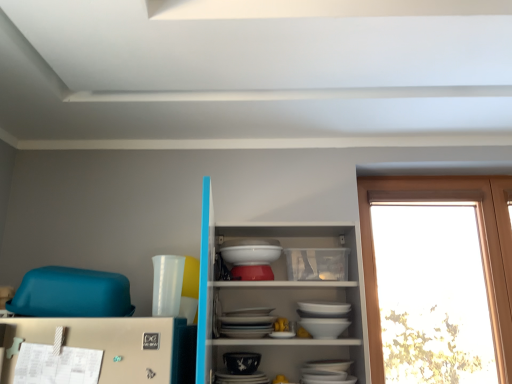
Question: Is porcelain bowl at center located within white glossy bowl at center?

Choices:
 (A) yes
 (B) no

Answer: (B)

Question: Is white glossy bowl at center touching porcelain bowl at center?

Choices:
 (A) no
 (B) yes

Answer: (A)

Question: Is white glossy bowl at center wider than porcelain bowl at center?

Choices:
 (A) yes
 (B) no

Answer: (A)

Question: Considering the relative sizes of white glossy bowl at center and porcelain bowl at center in the image provided, is white glossy bowl at center thinner than porcelain bowl at center?

Choices:
 (A) no
 (B) yes

Answer: (A)

Question: Is white glossy bowl at center at the left side of porcelain bowl at center?

Choices:
 (A) yes
 (B) no

Answer: (B)

Question: Is white glossy bowl at center turned away from porcelain bowl at center?

Choices:
 (A) no
 (B) yes

Answer: (A)

Question: Does transparent glass window at right come in front of white glossy bowls at center?

Choices:
 (A) no
 (B) yes

Answer: (A)

Question: Is the position of transparent glass window at right more distant than that of white glossy bowls at center?

Choices:
 (A) yes
 (B) no

Answer: (A)

Question: Could you tell me if transparent glass window at right is facing white glossy bowls at center?

Choices:
 (A) yes
 (B) no

Answer: (B)

Question: Can you confirm if transparent glass window at right is shorter than white glossy bowls at center?

Choices:
 (A) yes
 (B) no

Answer: (B)

Question: From the image's perspective, is transparent glass window at right on white glossy bowls at center?

Choices:
 (A) no
 (B) yes

Answer: (A)

Question: Is transparent glass window at right at the left side of white glossy bowls at center?

Choices:
 (A) no
 (B) yes

Answer: (A)

Question: Is transparent glass window at right at the right side of porcelain bowl at center?

Choices:
 (A) no
 (B) yes

Answer: (B)